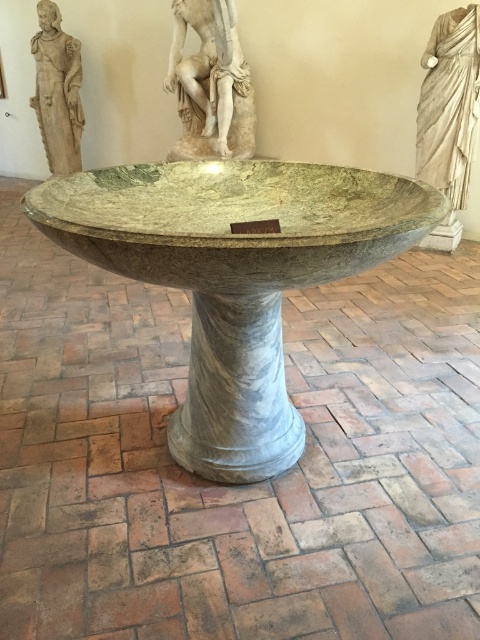
You are an interior designer planning to place a new decorative item between the green marble bowl at center and the white marble statue at upper center. Considering their sizes, which object should you position closer to the edge of the display area to ensure the new item has enough space?

Since the green marble bowl at center is wider than the white marble statue at upper center, you should position the white marble statue at upper center closer to the edge to leave more space for the new decorative item near the green marble bowl at center.

You are an art conservator examining the marble basin in the museum. You need to place a protective barrier between the two points marked as point (229, 113) and point (78, 138). Which point is closer to the viewer where you should start placing the barrier?

Point (229, 113) is closer to the viewer than point (78, 138), so you should start placing the barrier at point (229, 113).